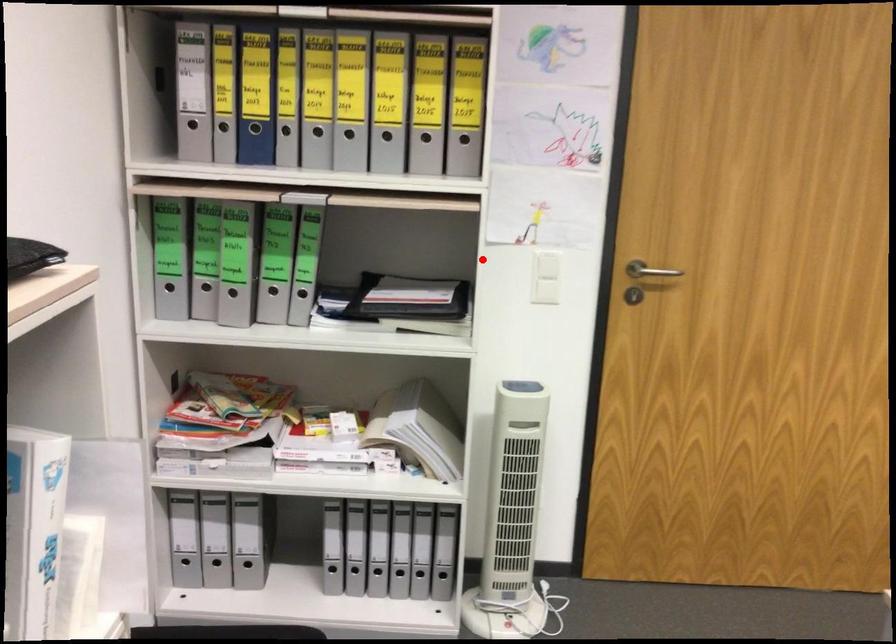
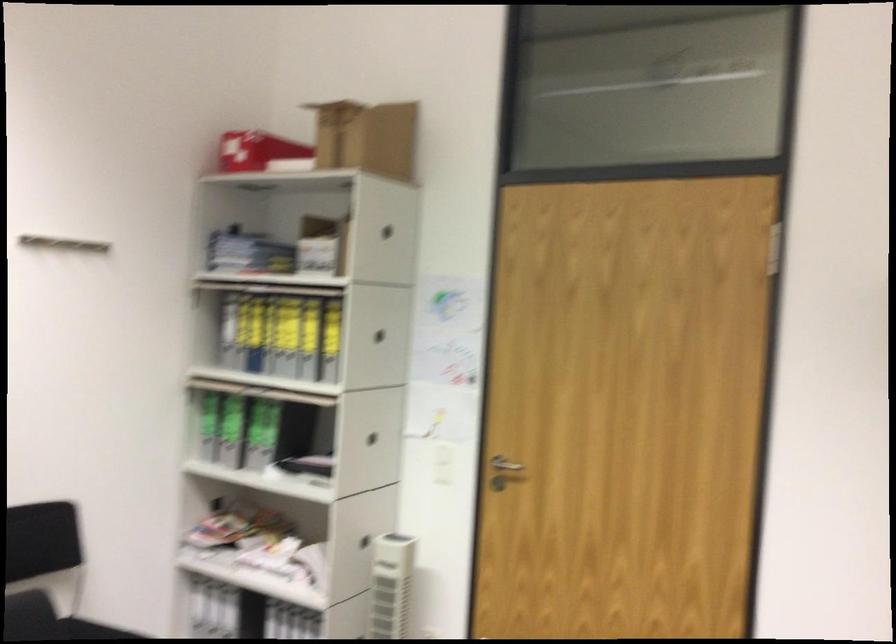
Question: I am providing you with two images of the same scene from different viewpoints. In image1, a red point is highlighted. Considering the same 3D point in image2, which of the following is correct?

Choices:
 (A) It is closer
 (B) It is farther

Answer: (B)